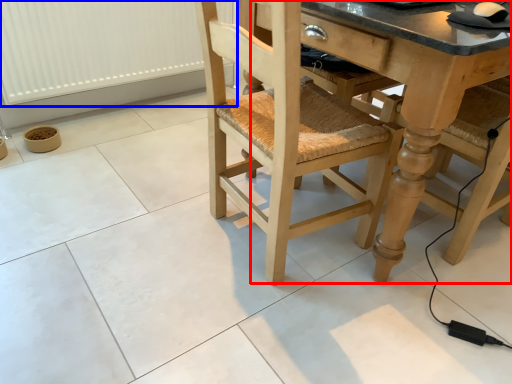
Question: Which point is closer to the camera, counter top (highlighted by a red box) or radiator (highlighted by a blue box)?

Choices:
 (A) counter top
 (B) radiator

Answer: (A)